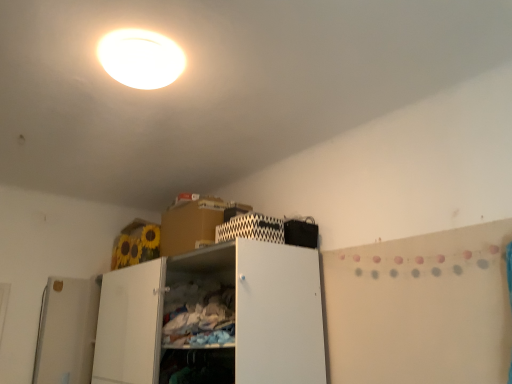
Question: Is white glossy ceiling light at upper center situated inside black zigzag-patterned cabinet at upper center or outside?

Choices:
 (A) inside
 (B) outside

Answer: (B)

Question: Looking at their shapes, would you say white glossy ceiling light at upper center is wider or thinner than black zigzag-patterned cabinet at upper center?

Choices:
 (A) thin
 (B) wide

Answer: (B)

Question: Estimate the real-world distances between objects in this image. Which object is closer to the white glossy ceiling light at upper center?

Choices:
 (A) black zigzag-patterned cabinet at upper center
 (B) white matte cabinet at center

Answer: (A)

Question: Which of these objects is positioned closest to the black zigzag-patterned cabinet at upper center?

Choices:
 (A) white matte cabinet at center
 (B) white glossy ceiling light at upper center

Answer: (A)